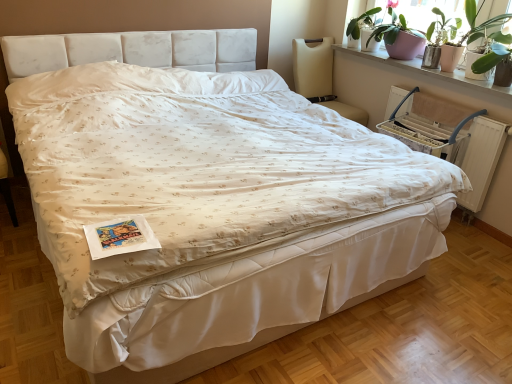
Question: Considering the relative sizes of green leafy plant at upper right and beige fabric chair at upper right in the image provided, is green leafy plant at upper right thinner than beige fabric chair at upper right?

Choices:
 (A) yes
 (B) no

Answer: (A)

Question: From a real-world perspective, is green leafy plant at upper right below beige fabric chair at upper right?

Choices:
 (A) no
 (B) yes

Answer: (A)

Question: Is green leafy plant at upper right positioned behind beige fabric chair at upper right?

Choices:
 (A) no
 (B) yes

Answer: (A)

Question: Is green leafy plant at upper right positioned with its back to beige fabric chair at upper right?

Choices:
 (A) no
 (B) yes

Answer: (A)

Question: Could you tell me if green leafy plant at upper right is turned towards beige fabric chair at upper right?

Choices:
 (A) yes
 (B) no

Answer: (B)

Question: Considering the relative positions of green leafy plant at upper right and beige fabric chair at upper right in the image provided, is green leafy plant at upper right in front of beige fabric chair at upper right?

Choices:
 (A) yes
 (B) no

Answer: (A)

Question: Is matte white window sill at upper right not within matte white window screen at upper right?

Choices:
 (A) no
 (B) yes

Answer: (B)

Question: Is matte white window sill at upper right wider than matte white window screen at upper right?

Choices:
 (A) yes
 (B) no

Answer: (A)

Question: Is matte white window sill at upper right aimed at matte white window screen at upper right?

Choices:
 (A) yes
 (B) no

Answer: (B)

Question: Does matte white window sill at upper right come in front of matte white window screen at upper right?

Choices:
 (A) no
 (B) yes

Answer: (B)

Question: Is matte white window sill at upper right oriented away from matte white window screen at upper right?

Choices:
 (A) no
 (B) yes

Answer: (A)

Question: Does matte white window sill at upper right have a lesser height compared to matte white window screen at upper right?

Choices:
 (A) yes
 (B) no

Answer: (A)

Question: From the image's perspective, would you say beige fabric chair at upper right is shown under matte white window screen at upper right?

Choices:
 (A) yes
 (B) no

Answer: (A)